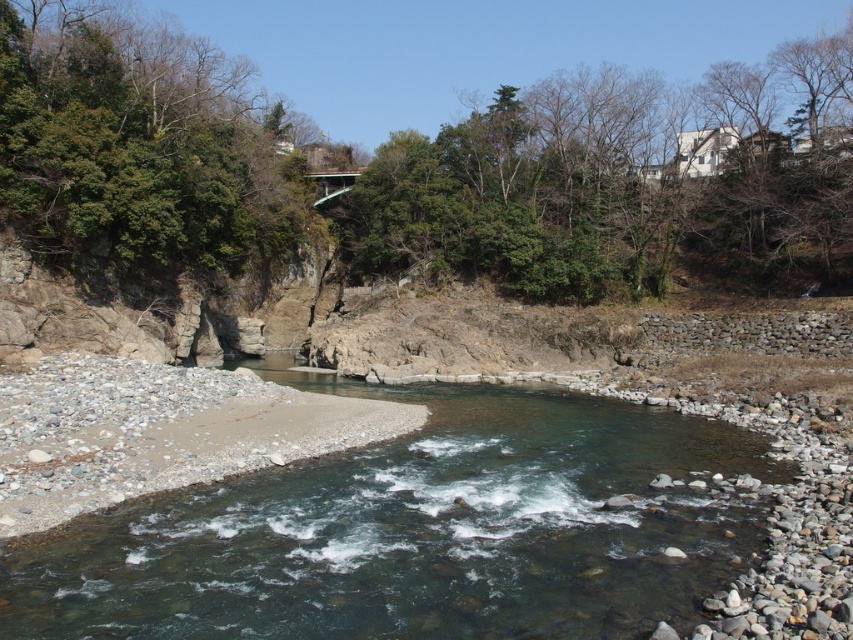
Question: Among these points, which one is nearest to the camera?

Choices:
 (A) (450, 195)
 (B) (187, 83)
 (C) (471, 422)

Answer: (C)

Question: Which of these objects is positioned closest to the green leafy tree at upper left?

Choices:
 (A) green leafy tree at upper center
 (B) clear water at center

Answer: (A)

Question: Is clear water at center smaller than green leafy tree at upper center?

Choices:
 (A) yes
 (B) no

Answer: (A)

Question: Can you confirm if clear water at center is thinner than green leafy tree at upper left?

Choices:
 (A) no
 (B) yes

Answer: (A)

Question: Based on their relative distances, which object is nearer to the clear water at center?

Choices:
 (A) green leafy tree at upper center
 (B) green leafy tree at upper left

Answer: (B)

Question: From the image, what is the correct spatial relationship of green leafy tree at upper center in relation to green leafy tree at upper left?

Choices:
 (A) above
 (B) below

Answer: (B)